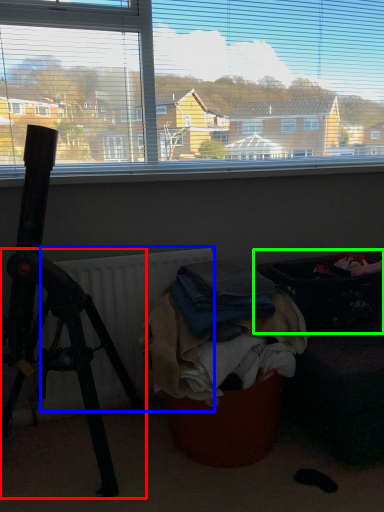
Question: Which is nearer to the tripod (highlighted by a red box)? radiator (highlighted by a blue box) or laundry basket (highlighted by a green box).

Choices:
 (A) radiator
 (B) laundry basket

Answer: (A)